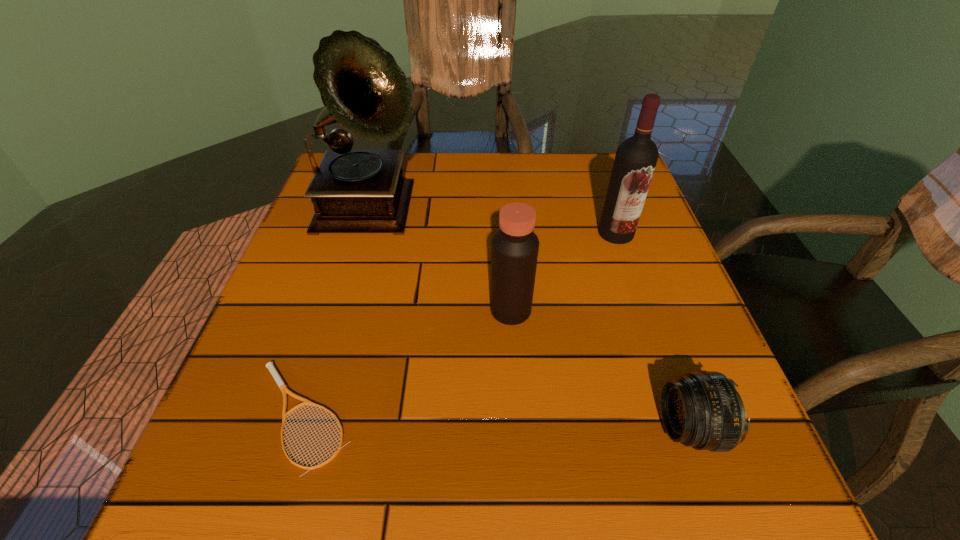
The height and width of the screenshot is (540, 960). I want to click on blank space located at the front element of the second shortest object, so click(x=564, y=428).

Locate an element on the screen. The height and width of the screenshot is (540, 960). vacant region located 0.280m at the front element of the second shortest object is located at coordinates (479, 428).

Identify the location of free space located on the right of the tennis racket. (453, 416).

The width and height of the screenshot is (960, 540). I want to click on object that is at the far edge, so click(363, 89).

Find the location of a particular element. telephoto lens situated at the near edge is located at coordinates [703, 410].

Locate an element on the screen. The width and height of the screenshot is (960, 540). tennis racket situated at the near edge is located at coordinates (270, 365).

Find the location of a particular element. record player present at the left edge is located at coordinates coord(363,89).

The image size is (960, 540). I want to click on tennis racket that is at the left edge, so click(x=270, y=365).

Find the location of a particular element. This screenshot has height=540, width=960. wine bottle positioned at the right edge is located at coordinates (636, 157).

Locate an element on the screen. The image size is (960, 540). telephoto lens at the right edge is located at coordinates (703, 410).